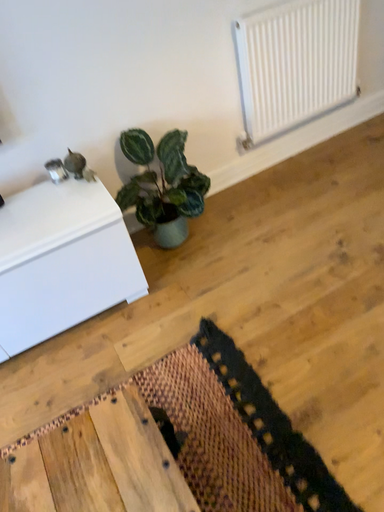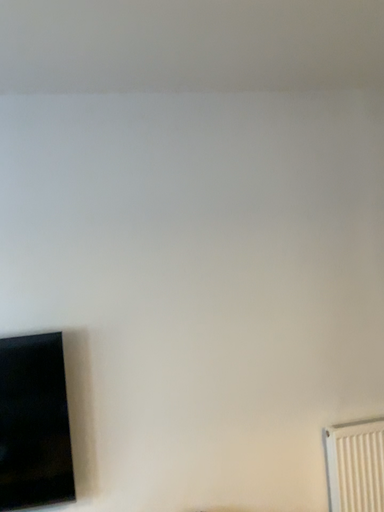
Question: How did the camera likely rotate when shooting the video?

Choices:
 (A) rotated right
 (B) rotated left

Answer: (B)